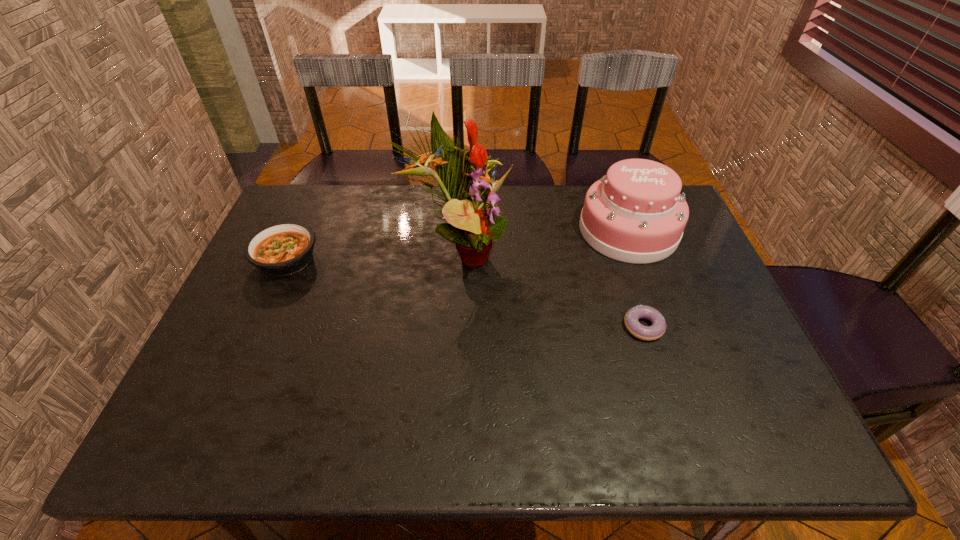
Locate which object ranks in proximity to the tallest object. Please provide its 2D coordinates. Your answer should be formatted as a tuple, i.e. [(x, y)], where the tuple contains the x and y coordinates of a point satisfying the conditions above.

[(635, 213)]

Identify the location of free location that satisfies the following two spatial constraints: 1. on the front-facing side of the third object from right to left; 2. on the right side of the shortest object. Image resolution: width=960 pixels, height=540 pixels. (455, 327).

You are a GUI agent. You are given a task and a screenshot of the screen. Output one action in this format:
    pyautogui.click(x=<x>, y=<y>)
    Task: Click on the vacant space that satisfies the following two spatial constraints: 1. on the front-facing side of the tallest object; 2. on the right side of the doughnut
    The width and height of the screenshot is (960, 540).
    Given the screenshot: What is the action you would take?
    pyautogui.click(x=455, y=327)

Locate an element on the screen. Image resolution: width=960 pixels, height=540 pixels. vacant area that satisfies the following two spatial constraints: 1. on the front-facing side of the second object from left to right; 2. on the right side of the doughnut is located at coordinates tap(455, 327).

Image resolution: width=960 pixels, height=540 pixels. In order to click on free point that satisfies the following two spatial constraints: 1. on the front side of the cake; 2. on the front-facing side of the second object from left to right in this screenshot , I will do (636, 252).

Find the location of `vacant point that satisfies the following two spatial constraints: 1. on the front-facing side of the tallest object; 2. on the right side of the doughnut`. vacant point that satisfies the following two spatial constraints: 1. on the front-facing side of the tallest object; 2. on the right side of the doughnut is located at coordinates (455, 327).

The height and width of the screenshot is (540, 960). Find the location of `vacant space that satisfies the following two spatial constraints: 1. on the front-facing side of the shortest object; 2. on the left side of the bouquet`. vacant space that satisfies the following two spatial constraints: 1. on the front-facing side of the shortest object; 2. on the left side of the bouquet is located at coordinates click(455, 327).